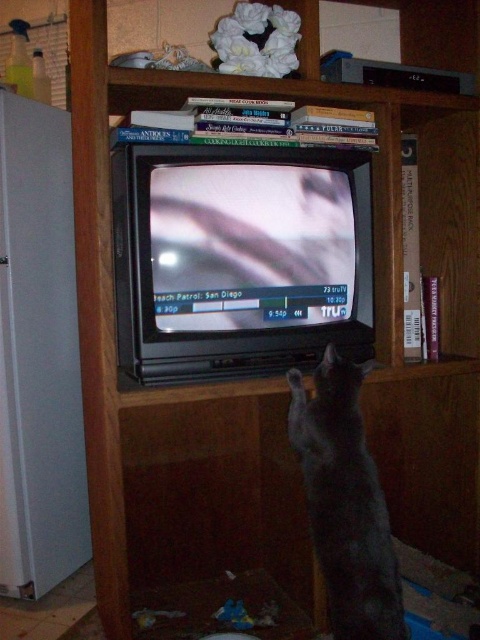
Does white matte refrigerator at left appear under shiny gray cat at center?

Incorrect, white matte refrigerator at left is not positioned below shiny gray cat at center.

Does point (9, 346) lie behind point (339, 438)?

Yes.

The height and width of the screenshot is (640, 480). Describe the element at coordinates (38, 355) in the screenshot. I see `white matte refrigerator at left` at that location.

At what (x,y) coordinates should I click in order to perform the action: click on white matte refrigerator at left. Please return your answer as a coordinate pair (x, y). Looking at the image, I should click on (38, 355).